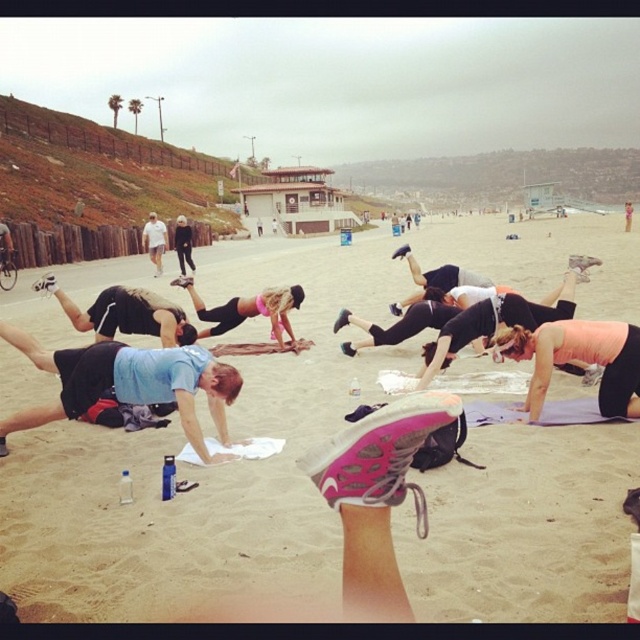
You are a photographer trying to capture a closeup of the two points in the image. Which point, point (164, 563) or point (260, 308), is closer to your camera?

Point (164, 563) is closer to the camera than point (260, 308).

You are a participant in the beach fitness class and need to place your pink matte yoga mat at lower right on the beige sand at center. Will the entire yoga mat fit on the sand area if the sand is wider than the mat?

The beige sand at center is wider than the pink matte yoga mat at lower right, so the entire yoga mat will fit on the sand area.